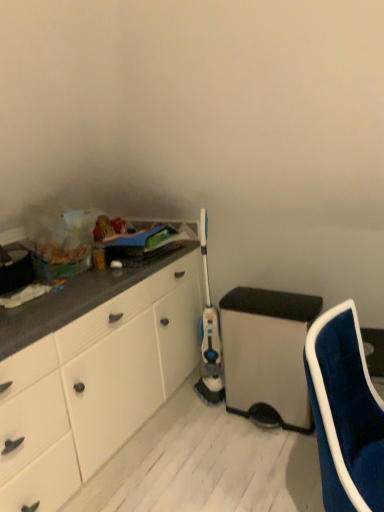
The image size is (384, 512). I want to click on free spot below matte plastic trash can at lower right (from a real-world perspective), so click(x=259, y=411).